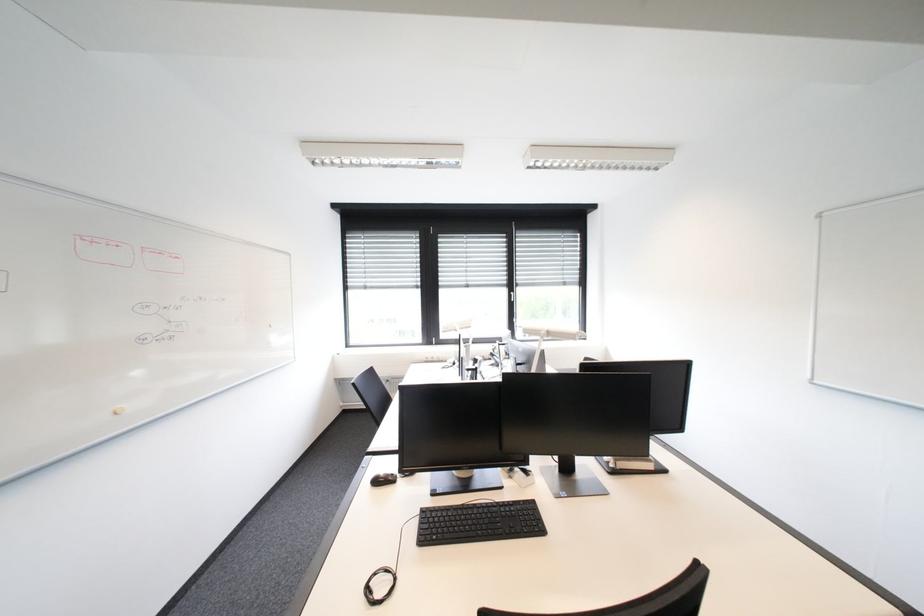
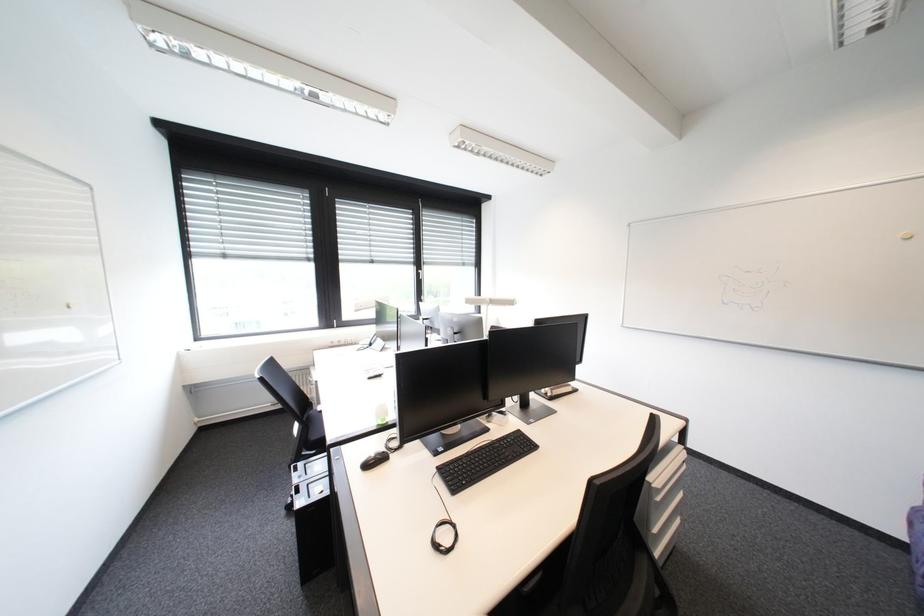
Question: The first image is from the beginning of the video and the second image is from the end. How did the camera likely rotate when shooting the video?

Choices:
 (A) Left
 (B) Right
 (C) Up
 (D) Down

Answer: (B)